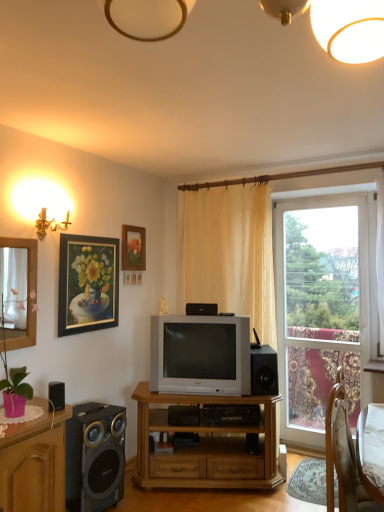
Question: Is wooden tv stand at center surrounding silver metallic television at center?

Choices:
 (A) no
 (B) yes

Answer: (A)

Question: From the image's perspective, is wooden tv stand at center over silver metallic television at center?

Choices:
 (A) no
 (B) yes

Answer: (A)

Question: Is wooden tv stand at center shorter than silver metallic television at center?

Choices:
 (A) no
 (B) yes

Answer: (A)

Question: From the image's perspective, would you say wooden tv stand at center is shown under silver metallic television at center?

Choices:
 (A) no
 (B) yes

Answer: (B)

Question: Is wooden tv stand at center to the right of silver metallic television at center from the viewer's perspective?

Choices:
 (A) yes
 (B) no

Answer: (A)

Question: From a real-world perspective, is wooden tv stand at center physically below silver metallic television at center?

Choices:
 (A) yes
 (B) no

Answer: (A)

Question: Could you tell me if black plastic speaker at center, the third speaker when ordered from left to right, is facing gold-framed painting at upper left, the second picture frame when ordered from back to front?

Choices:
 (A) yes
 (B) no

Answer: (B)

Question: Is the depth of black plastic speaker at center, which is the 1th speaker in back-to-front order, greater than that of gold-framed painting at upper left, which is the second picture frame from right to left?

Choices:
 (A) yes
 (B) no

Answer: (A)

Question: Is black plastic speaker at center, which is the 1th speaker in back-to-front order, positioned beyond the bounds of gold-framed painting at upper left, which is the 1th picture frame in left-to-right order?

Choices:
 (A) yes
 (B) no

Answer: (A)

Question: Is black plastic speaker at center, which is the first speaker from top to bottom, closer to the viewer compared to gold-framed painting at upper left, which is the 1th picture frame in left-to-right order?

Choices:
 (A) yes
 (B) no

Answer: (B)

Question: From a real-world perspective, is black plastic speaker at center, which ranks as the second speaker in right-to-left order, located beneath gold-framed painting at upper left, which is the 1th picture frame in left-to-right order?

Choices:
 (A) no
 (B) yes

Answer: (B)

Question: Does black plastic speaker at center, which is the 1th speaker in back-to-front order, have a lesser height compared to gold-framed painting at upper left, the 1th picture frame when ordered from front to back?

Choices:
 (A) yes
 (B) no

Answer: (A)

Question: Can you confirm if matte wooden picture frame at upper center, acting as the 2th picture frame starting from the front, is smaller than clear glass window at right?

Choices:
 (A) yes
 (B) no

Answer: (A)